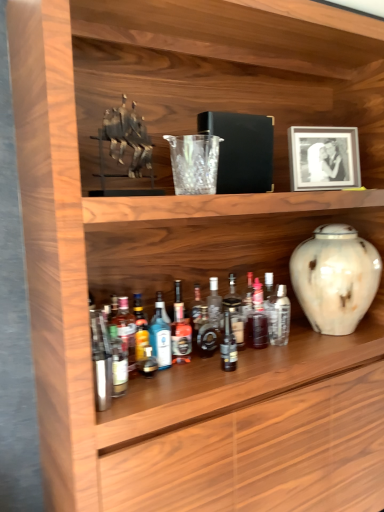
Question: Would you say translucent glass bottle at center, which appears as the seventh bottle when viewed from the right, is inside or outside translucent glass bottle at center, placed as the 2th bottle when sorted from right to left?

Choices:
 (A) outside
 (B) inside

Answer: (A)

Question: Would you say translucent glass bottle at center, which appears as the seventh bottle when viewed from the right, is to the left or to the right of translucent glass bottle at center, placed as the 2th bottle when sorted from right to left, in the picture?

Choices:
 (A) right
 (B) left

Answer: (B)

Question: Considering the real-world distances, which object is farthest from the translucent glass bottle at center, the 3th bottle in the left-to-right sequence?

Choices:
 (A) clear glass bottle at center, acting as the seventh bottle starting from the left
 (B) matte glass bottle at center, the 3th bottle when ordered from right to left
 (C) blue glass bottle at center, the sixth bottle when ordered from right to left
 (D) translucent glass bottle at center, which appears as the seventh bottle when viewed from the right
 (E) shiny dark glass bottle at center, which is the fourth bottle from right to left

Answer: (A)

Question: Which object is positioned closest to the blue glass bottle at center, which is the 2th bottle from left to right?

Choices:
 (A) clear glass bottle at center, acting as the seventh bottle starting from the left
 (B) matte glass bottle at center, the 3th bottle when ordered from right to left
 (C) translucent glass bottle at center, the sixth bottle when ordered from left to right
 (D) shiny dark glass bottle at center, the 4th bottle positioned from the left
 (E) translucent glass bottle at center, the 3th bottle in the left-to-right sequence

Answer: (E)